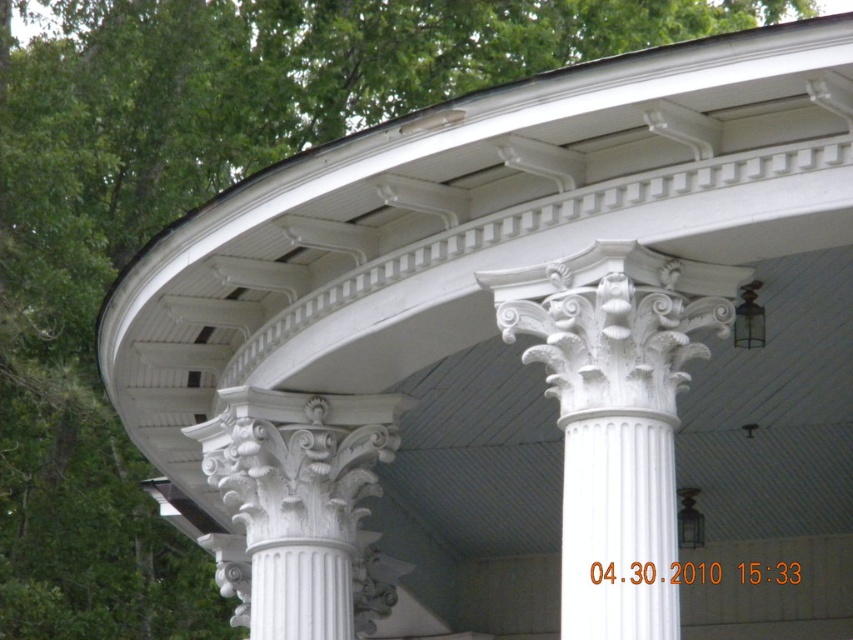
You are an architect examining the classical building. You notice two columns at the center. Which one is smaller in size between the white marble column at center and the white textured column at center?

The white marble column at center has a smaller size compared to the white textured column at center, so the white marble column at center is the smaller one.

You are an architect designing a replica of this classical building. You need to ensure that the columns match the original dimensions. Which column has a narrower diameter between the white marble column at center and the white textured column at center?

The white marble column at center has a lesser width compared to the white textured column at center, so the white marble column at center is narrower in diameter.

Looking at this image, you are an architect inspecting the classical building. You notice a specific point at coordinates (616, 417). Based on the scene, which architectural element is this point located on?

The point at coordinates (616, 417) is located on the white marble column at center.